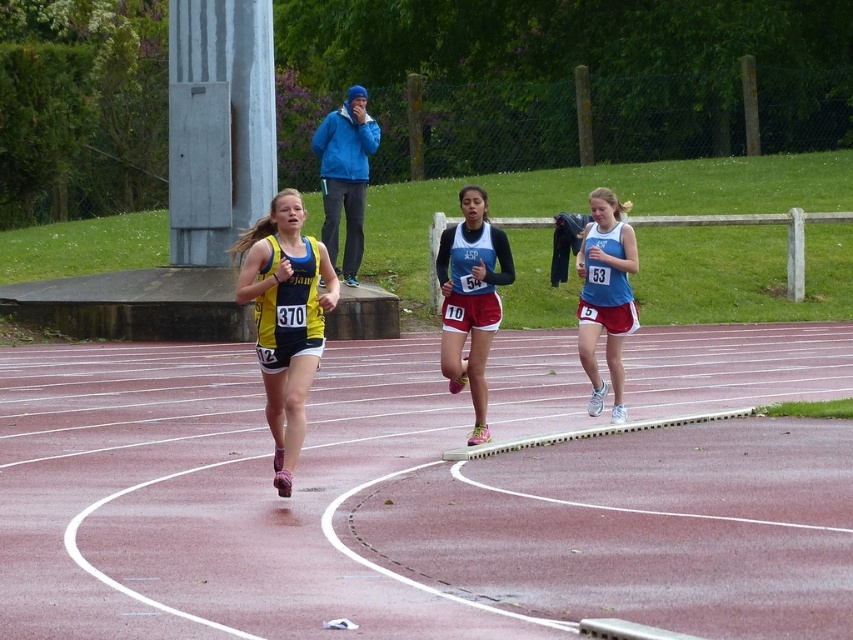
Question: Can you confirm if matte black and red running uniform at center is positioned to the left of matte blue tank top at center?

Choices:
 (A) yes
 (B) no

Answer: (A)

Question: Can you confirm if matte black and red running uniform at center is bigger than matte blue tank top at center?

Choices:
 (A) no
 (B) yes

Answer: (B)

Question: Which of the following is the closest to the observer?

Choices:
 (A) (596, 413)
 (B) (480, 328)

Answer: (B)

Question: Does pink rubber track at center lie behind matte black and red running uniform at center?

Choices:
 (A) no
 (B) yes

Answer: (A)

Question: Which object is farther from the camera taking this photo?

Choices:
 (A) pink rubber track at center
 (B) matte blue tank top at center
 (C) matte black and red running uniform at center

Answer: (B)

Question: Which of these objects is positioned farthest from the yellow fabric running suit at center?

Choices:
 (A) pink rubber track at center
 (B) matte blue tank top at center
 (C) matte black and red running uniform at center

Answer: (B)